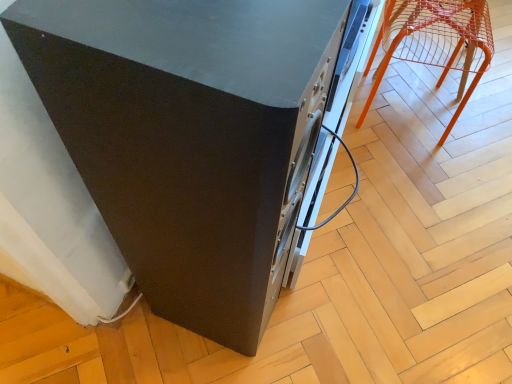
Question: Is matte black speaker at center inside the boundaries of orange wire mesh chair at upper right, or outside?

Choices:
 (A) outside
 (B) inside

Answer: (A)

Question: Is point (281, 62) positioned closer to the camera than point (487, 51)?

Choices:
 (A) closer
 (B) farther

Answer: (A)

Question: In terms of width, does matte black speaker at center look wider or thinner when compared to orange wire mesh chair at upper right?

Choices:
 (A) wide
 (B) thin

Answer: (A)

Question: From the image's perspective, relative to matte black speaker at center, is orange wire mesh chair at upper right above or below?

Choices:
 (A) above
 (B) below

Answer: (A)

Question: Is point (375, 82) positioned closer to the camera than point (306, 51)?

Choices:
 (A) farther
 (B) closer

Answer: (A)

Question: Relative to matte black speaker at center, is orange wire mesh chair at upper right in front or behind?

Choices:
 (A) front
 (B) behind

Answer: (B)

Question: Is orange wire mesh chair at upper right wider or thinner than matte black speaker at center?

Choices:
 (A) thin
 (B) wide

Answer: (A)